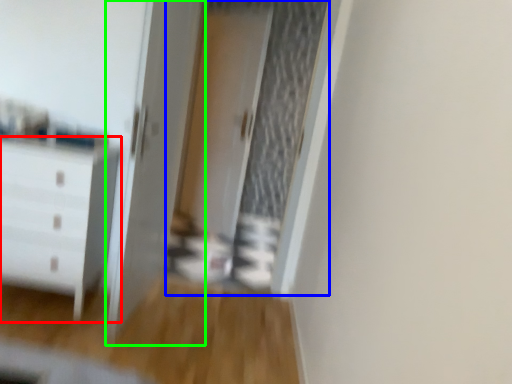
Question: Estimate the real-world distances between objects in this image. Which object is closer to chest of drawers (highlighted by a red box), screen door (highlighted by a blue box) or door (highlighted by a green box)?

Choices:
 (A) screen door
 (B) door

Answer: (B)